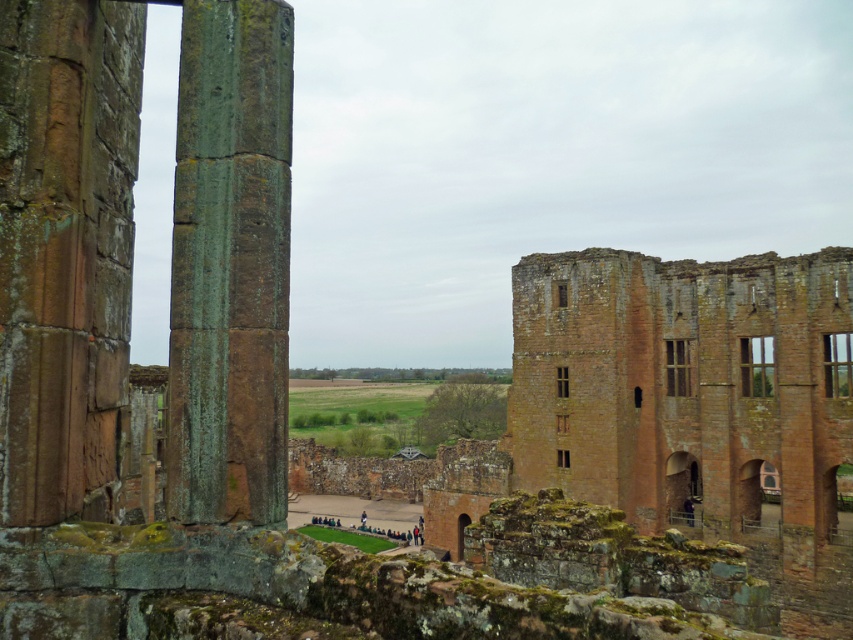
Consider the image. Who is higher up, brown stone window at center-right or dark blue fabric at lower right?

brown stone window at center-right is above.

Who is more distant from viewer, (556, 454) or (689, 516)?

Positioned behind is point (556, 454).

Find the location of a particular element. The height and width of the screenshot is (640, 853). brown stone window at center-right is located at coordinates (561, 458).

Is wooden window at right bigger than brown stone window at upper center?

Correct, wooden window at right is larger in size than brown stone window at upper center.

In order to click on wooden window at right in this screenshot , I will do `click(837, 364)`.

Between point (558, 376) and point (563, 426), which one is positioned in front?

Point (563, 426) is more forward.

Who is positioned more to the left, brown wooden window at center-right or brown stone window at center?

Positioned to the left is brown stone window at center.

Who is more forward, (558, 394) or (558, 432)?

Point (558, 432)

You are a GUI agent. You are given a task and a screenshot of the screen. Output one action in this format:
    pyautogui.click(x=<x>, y=<y>)
    Task: Click on the brown wooden window at center-right
    The image size is (853, 640).
    Given the screenshot: What is the action you would take?
    561,381